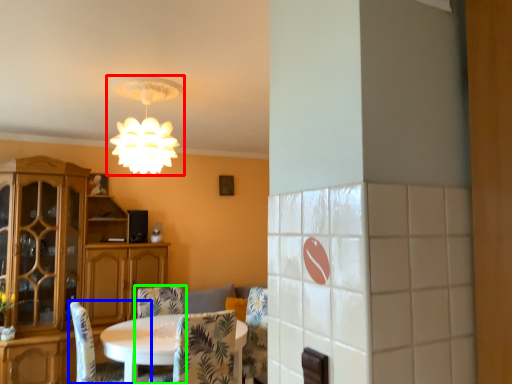
Question: Which object is positioned farthest from lamp (highlighted by a red box)? Select from chair (highlighted by a blue box) and chair (highlighted by a green box).

Choices:
 (A) chair
 (B) chair

Answer: (B)